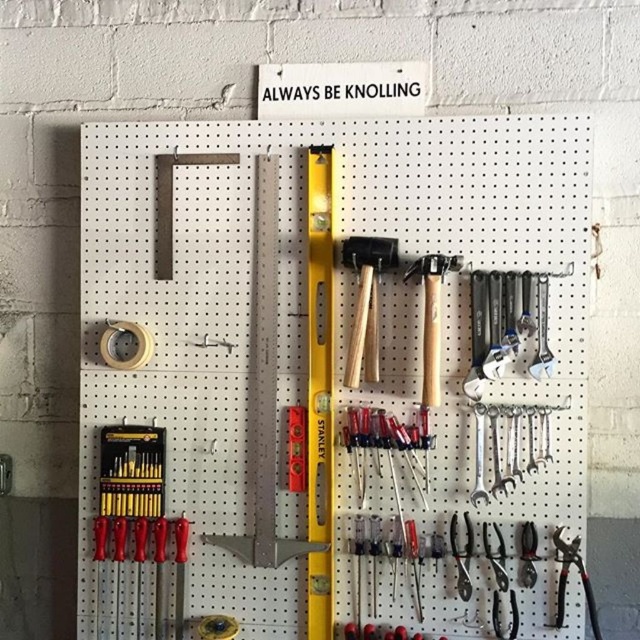
You are a contractor who needs to reach both the matte black screwdriver set at lower left and the wooden mallets at center. Your tool belt has a 20 inch reach. Can you comfortably reach both items without moving your position?

The matte black screwdriver set at lower left and wooden mallets at center are 18.49 inches apart from each other. Since your tool belt has a 20 inch reach, you can comfortably reach both items without moving your position as the distance between them is within your reach range.